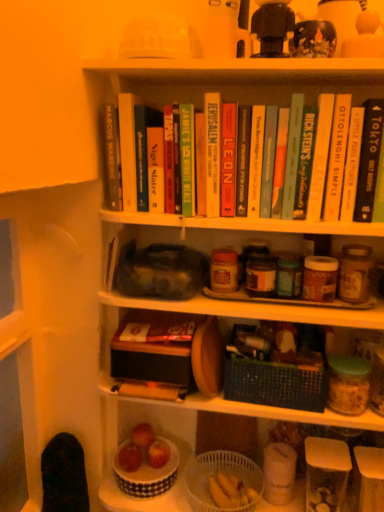
At what (x,y) coordinates should I click in order to perform the action: click on red matte apple at lower center. Please return your answer as a coordinate pair (x, y). The width and height of the screenshot is (384, 512). Looking at the image, I should click on (158, 453).

The width and height of the screenshot is (384, 512). I want to click on smooth plastic toy at upper right, which is the first toy from right to left, so click(x=365, y=36).

Image resolution: width=384 pixels, height=512 pixels. Find the location of `translucent plastic containers at center, which is counted as the third shelf, starting from the bottom`. translucent plastic containers at center, which is counted as the third shelf, starting from the bottom is located at coordinates (255, 310).

Measure the distance between black plastic toy at upper center, the first toy positioned from the left, and camera.

They are 34.57 inches apart.

Find the location of a particular element. black plastic toy at upper center, the first toy positioned from the left is located at coordinates (272, 27).

Where is `green matte book at center, the 4th paperback book from the left`? The height and width of the screenshot is (512, 384). green matte book at center, the 4th paperback book from the left is located at coordinates (187, 159).

From a real-world perspective, is hardcover book at upper center, the 7th paperback book from the right, located beneath smooth plastic toy at upper right, which appears as the 2th toy when viewed from the left?

Indeed, from a real-world perspective, hardcover book at upper center, the 7th paperback book from the right, is positioned beneath smooth plastic toy at upper right, which appears as the 2th toy when viewed from the left.

Identify the location of toy that is the 1st object located in front of the hardcover book at upper center, the seventh paperback book viewed from the left. The image size is (384, 512). 365,36.

Considering the sizes of objects hardcover book at upper center, the seventh paperback book viewed from the left, and smooth plastic toy at upper right, which appears as the 2th toy when viewed from the left, in the image provided, who is bigger, hardcover book at upper center, the seventh paperback book viewed from the left, or smooth plastic toy at upper right, which appears as the 2th toy when viewed from the left,?

Bigger between the two is hardcover book at upper center, the seventh paperback book viewed from the left.

Can you confirm if hardcover book at upper center, the seventh paperback book viewed from the left, is positioned to the left of smooth plastic toy at upper right, which is the first toy from right to left?

Indeed, hardcover book at upper center, the seventh paperback book viewed from the left, is positioned on the left side of smooth plastic toy at upper right, which is the first toy from right to left.

There is a translucent plastic containers at center, acting as the 1th shelf starting from the top. Identify the location of the 4th paperback book above it (from the image's perspective). The height and width of the screenshot is (512, 384). (155, 169).

How far apart are hardcover book at center, acting as the 3th paperback book starting from the left, and translucent plastic containers at center, which is counted as the third shelf, starting from the bottom?

hardcover book at center, acting as the 3th paperback book starting from the left, is 12.34 inches from translucent plastic containers at center, which is counted as the third shelf, starting from the bottom.

Is hardcover book at center, acting as the 3th paperback book starting from the left, bigger or smaller than translucent plastic containers at center, acting as the 1th shelf starting from the top?

Clearly, hardcover book at center, acting as the 3th paperback book starting from the left, is smaller in size than translucent plastic containers at center, acting as the 1th shelf starting from the top.

Considering the relative positions of hardcover book at center, positioned as the eleventh paperback book in right-to-left order, and translucent plastic containers at center, which is counted as the third shelf, starting from the bottom, in the image provided, is hardcover book at center, positioned as the eleventh paperback book in right-to-left order, behind translucent plastic containers at center, which is counted as the third shelf, starting from the bottom,?

Yes, hardcover book at center, positioned as the eleventh paperback book in right-to-left order, is further from the camera.

Is hardcover book at upper center, acting as the 10th paperback book starting from the left, facing away from smooth plastic toy at upper right, which appears as the 2th toy when viewed from the left?

hardcover book at upper center, acting as the 10th paperback book starting from the left, is not turned away from smooth plastic toy at upper right, which appears as the 2th toy when viewed from the left.

Is hardcover book at upper center, acting as the 10th paperback book starting from the left, in front of or behind smooth plastic toy at upper right, which is the first toy from right to left, in the image?

hardcover book at upper center, acting as the 10th paperback book starting from the left, is behind smooth plastic toy at upper right, which is the first toy from right to left.

Between hardcover book at upper center, which is the 4th paperback book in right-to-left order, and smooth plastic toy at upper right, which is the first toy from right to left, which one has larger size?

hardcover book at upper center, which is the 4th paperback book in right-to-left order, is bigger.

Is hardcover book at upper center, acting as the 10th paperback book starting from the left, placed right next to smooth plastic toy at upper right, which is the first toy from right to left?

No, hardcover book at upper center, acting as the 10th paperback book starting from the left, is not beside smooth plastic toy at upper right, which is the first toy from right to left.

Based on the photo, is hardcover yellow book at upper center, which is the 11th paperback book from left to right, wider or thinner than black woven basket at center, marked as the second basket in a bottom-to-top arrangement?

hardcover yellow book at upper center, which is the 11th paperback book from left to right, is thinner than black woven basket at center, marked as the second basket in a bottom-to-top arrangement.

Would you say black woven basket at center, marked as the second basket in a bottom-to-top arrangement, is part of hardcover yellow book at upper center, which is the 11th paperback book from left to right,'s contents?

No, black woven basket at center, marked as the second basket in a bottom-to-top arrangement, is located outside of hardcover yellow book at upper center, which is the 11th paperback book from left to right.

Can you confirm if hardcover yellow book at upper center, marked as the third paperback book in a right-to-left arrangement, is bigger than black woven basket at center, arranged as the first basket when viewed from the top?

Incorrect, hardcover yellow book at upper center, marked as the third paperback book in a right-to-left arrangement, is not larger than black woven basket at center, arranged as the first basket when viewed from the top.

What's the angular difference between hardcover yellow book at upper center, which is the 11th paperback book from left to right, and black woven basket at center, arranged as the first basket when viewed from the top,'s facing directions?

2.99 degrees.

Is hardcover book at upper left, which ranks as the 1th paperback book in left-to-right order, not inside hardcover yellow book at upper center, marked as the third paperback book in a right-to-left arrangement?

That's correct, hardcover book at upper left, which ranks as the 1th paperback book in left-to-right order, is outside of hardcover yellow book at upper center, marked as the third paperback book in a right-to-left arrangement.

Is hardcover book at upper left, which is the thirteenth paperback book from right to left, bigger or smaller than hardcover yellow book at upper center, marked as the third paperback book in a right-to-left arrangement?

hardcover book at upper left, which is the thirteenth paperback book from right to left, is smaller than hardcover yellow book at upper center, marked as the third paperback book in a right-to-left arrangement.

Considering the sizes of objects hardcover book at upper left, which is the thirteenth paperback book from right to left, and hardcover yellow book at upper center, which is the 11th paperback book from left to right, in the image provided, who is thinner, hardcover book at upper left, which is the thirteenth paperback book from right to left, or hardcover yellow book at upper center, which is the 11th paperback book from left to right,?

With smaller width is hardcover yellow book at upper center, which is the 11th paperback book from left to right.

Considering the positions of points (186, 170) and (255, 314), is point (186, 170) farther from camera compared to point (255, 314)?

No.

Are green matte book at center, the tenth paperback book in the right-to-left sequence, and wooden basket at center, which is the second shelf from top to bottom, making contact?

green matte book at center, the tenth paperback book in the right-to-left sequence, and wooden basket at center, which is the second shelf from top to bottom, are not in contact.

How many degrees apart are the facing directions of green matte book at center, the tenth paperback book in the right-to-left sequence, and wooden basket at center, acting as the 2th shelf starting from the bottom?

The angular difference between green matte book at center, the tenth paperback book in the right-to-left sequence, and wooden basket at center, acting as the 2th shelf starting from the bottom, is 5.13 degrees.

Between green matte book at center, the tenth paperback book in the right-to-left sequence, and wooden basket at center, acting as the 2th shelf starting from the bottom, which one has larger size?

wooden basket at center, acting as the 2th shelf starting from the bottom.

Is point (265, 392) positioned behind point (214, 205)?

Yes.

Is black woven basket at center, arranged as the first basket when viewed from the top, to the right of hardcover book at center, the 8th paperback book viewed from the right, from the viewer's perspective?

Yes.

Is black woven basket at center, marked as the second basket in a bottom-to-top arrangement, positioned in front of hardcover book at center, the 8th paperback book viewed from the right?

No, black woven basket at center, marked as the second basket in a bottom-to-top arrangement, is further to the viewer.

From the image's perspective, would you say black woven basket at center, marked as the second basket in a bottom-to-top arrangement, is shown under hardcover book at center, the 8th paperback book viewed from the right?

Yes.

Find the location of `the 5th paperback book to the left of the smooth plastic toy at upper right, which appears as the 2th toy when viewed from the left, starting your count from the anchor`. the 5th paperback book to the left of the smooth plastic toy at upper right, which appears as the 2th toy when viewed from the left, starting your count from the anchor is located at coordinates click(228, 159).

Locate an element on the screen. The image size is (384, 512). the 2nd shelf in front of the hardcover book at center, acting as the 3th paperback book starting from the left is located at coordinates (255, 310).

Looking at the image, which one is located further to green matte book at center, the 4th paperback book from the left, smooth plastic toy at upper right, which appears as the 2th toy when viewed from the left, or hardcover book at upper center, the seventh paperback book viewed from the left?

Among the two, smooth plastic toy at upper right, which appears as the 2th toy when viewed from the left, is located further to green matte book at center, the 4th paperback book from the left.

Based on their spatial positions, is green matte book at center, the 4th paperback book from the left, or hardcover book at upper center, which is the 5th paperback book in left-to-right order, closer to white plastic basket at lower center, which is the first basket in bottom-to-top order?

hardcover book at upper center, which is the 5th paperback book in left-to-right order.

Estimate the real-world distances between objects in this image. Which object is closer to black woven basket at center, arranged as the first basket when viewed from the top, smooth plastic toy at upper right, which appears as the 2th toy when viewed from the left, or green matte book at center, the tenth paperback book in the right-to-left sequence?

Based on the image, green matte book at center, the tenth paperback book in the right-to-left sequence, appears to be nearer to black woven basket at center, arranged as the first basket when viewed from the top.

Based on their spatial positions, is hardcover book at upper center, which is counted as the 8th paperback book, starting from the left, or hardcover book at upper left, which is the thirteenth paperback book from right to left, further from hardcover yellow book at upper center, which is the 11th paperback book from left to right?

hardcover book at upper left, which is the thirteenth paperback book from right to left, is further to hardcover yellow book at upper center, which is the 11th paperback book from left to right.

Based on their spatial positions, is wooden basket at center, acting as the 2th shelf starting from the bottom, or hardcover book at upper right, the 12th paperback book when ordered from left to right, closer to black plastic toy at upper center, the first toy positioned from the left?

hardcover book at upper right, the 12th paperback book when ordered from left to right, lies closer to black plastic toy at upper center, the first toy positioned from the left, than the other object.

Considering their positions, is hardcover book at upper center, which appears as the 5th paperback book when viewed from the right, positioned further to hardcover book at upper center, the seventh paperback book viewed from the left, than hardcover book at upper left, which is the thirteenth paperback book from right to left?

hardcover book at upper left, which is the thirteenth paperback book from right to left, is positioned further to the anchor hardcover book at upper center, the seventh paperback book viewed from the left.

From the picture: Estimate the real-world distances between objects in this image. Which object is closer to black plastic toy at upper center, the first toy positioned from the left, hardcover book at upper center, positioned as the 6th paperback book in right-to-left order, or hardcover book at upper center, which appears as the 5th paperback book when viewed from the right?

Among the two, hardcover book at upper center, which appears as the 5th paperback book when viewed from the right, is located nearer to black plastic toy at upper center, the first toy positioned from the left.

From the image, which object appears to be nearer to hardcover book at upper center, the 12th paperback book from the right, translucent plastic containers at center, acting as the 1th shelf starting from the top, or wooden basket at center, acting as the 2th shelf starting from the bottom?

Among the two, translucent plastic containers at center, acting as the 1th shelf starting from the top, is located nearer to hardcover book at upper center, the 12th paperback book from the right.

Where is `apple between black plastic toy at upper center, which ranks as the second toy in right-to-left order, and white plastic basket at lower center, marked as the 1th shelf in a bottom-to-top arrangement, vertically`? The height and width of the screenshot is (512, 384). apple between black plastic toy at upper center, which ranks as the second toy in right-to-left order, and white plastic basket at lower center, marked as the 1th shelf in a bottom-to-top arrangement, vertically is located at coordinates (158, 453).

Locate an element on the screen. The width and height of the screenshot is (384, 512). basket between wooden basket at center, acting as the 2th shelf starting from the bottom, and white plastic basket at lower center, the third shelf when ordered from top to bottom, from top to bottom is located at coordinates (215, 473).

Find the location of a particular element. Image resolution: width=384 pixels, height=512 pixels. bowl between hardcover book at upper right, the 12th paperback book when ordered from left to right, and white plastic basket at lower center, marked as the 1th shelf in a bottom-to-top arrangement, in the vertical direction is located at coordinates (148, 475).

At what (x,y) coordinates should I click in order to perform the action: click on basket between hardcover book at center, which appears as the sixth paperback book when viewed from the left, and white plastic basket at lower center, which is the first basket in bottom-to-top order, from top to bottom. Please return your answer as a coordinate pair (x, y). Looking at the image, I should click on (275, 384).